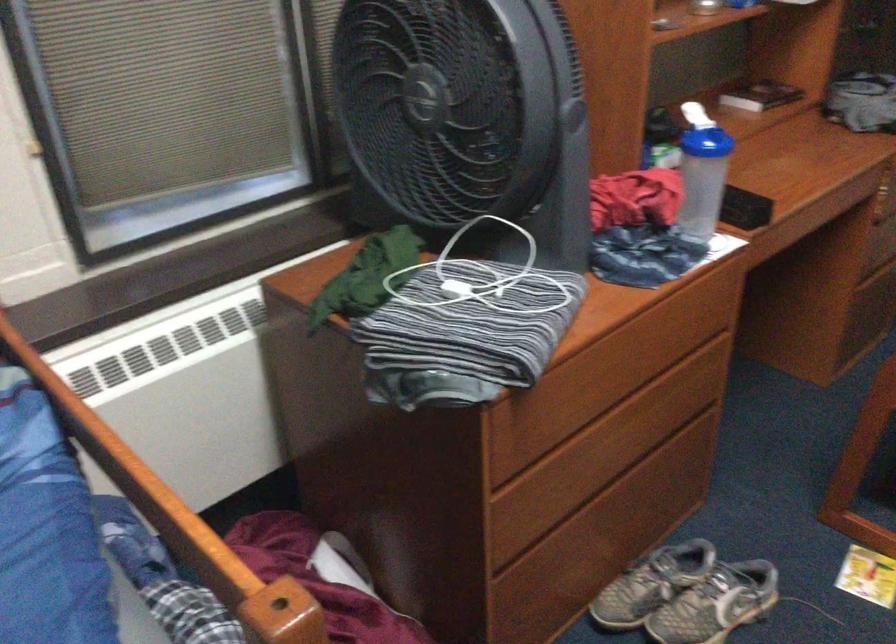
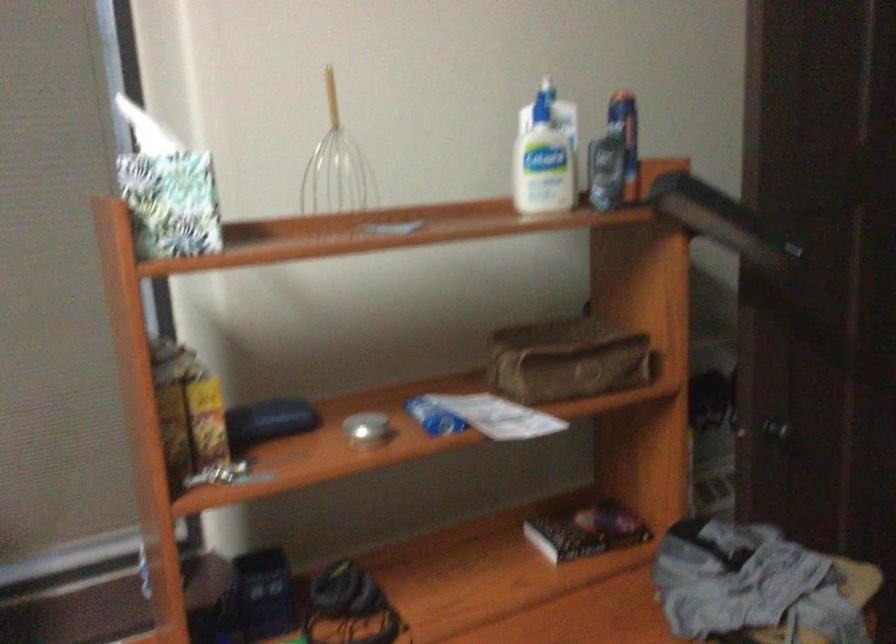
Which direction would the cameraman need to move to produce the second image?

The movement direction of the cameraman is right, forward.